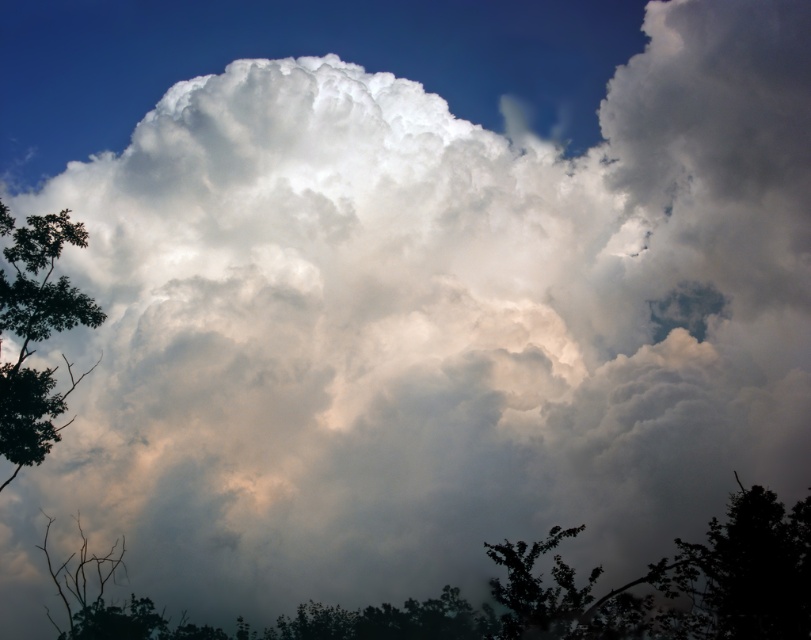
Can you confirm if green leafy tree at lower center is positioned below green leafy tree at left?

Yes, green leafy tree at lower center is below green leafy tree at left.

This screenshot has width=811, height=640. I want to click on green leafy tree at lower center, so click(x=561, y=595).